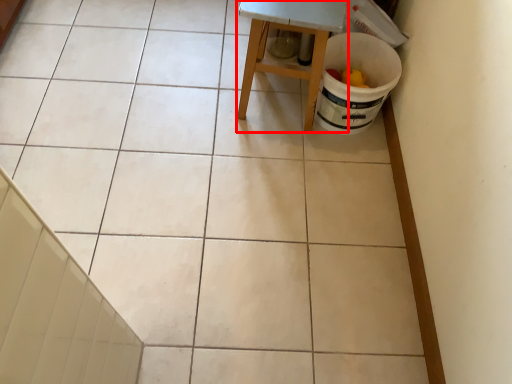
Question: Considering the relative positions of furniture (annotated by the red box) and stair in the image provided, where is furniture (annotated by the red box) located with respect to the staircase?

Choices:
 (A) right
 (B) left

Answer: (A)